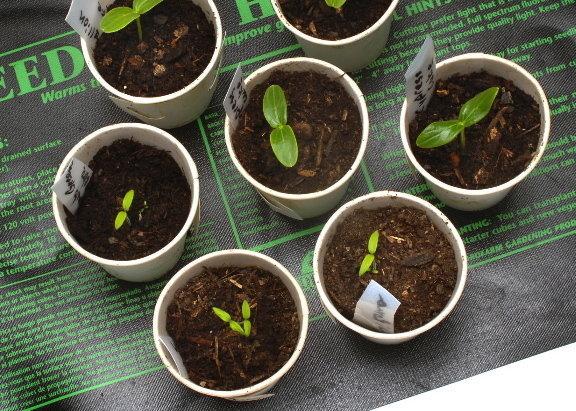
Identify the location of styrofoam cup. (193, 202), (219, 252), (319, 252), (435, 182), (359, 157), (218, 28), (346, 43).